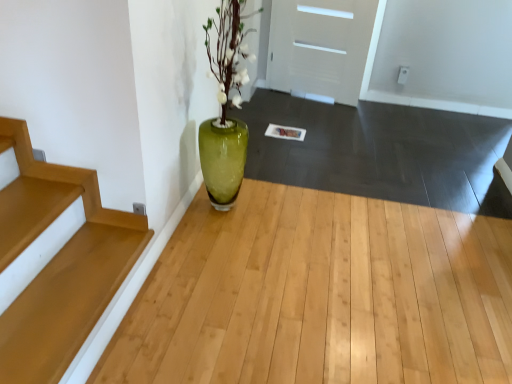
Question: From the image's perspective, is white matte door at upper center on top of green glass vase at center?

Choices:
 (A) yes
 (B) no

Answer: (A)

Question: Is white matte door at upper center taller than green glass vase at center?

Choices:
 (A) yes
 (B) no

Answer: (A)

Question: Does white matte door at upper center have a lesser width compared to green glass vase at center?

Choices:
 (A) no
 (B) yes

Answer: (B)

Question: Is white matte door at upper center bigger than green glass vase at center?

Choices:
 (A) yes
 (B) no

Answer: (B)

Question: Could you tell me if white matte door at upper center is turned towards green glass vase at center?

Choices:
 (A) yes
 (B) no

Answer: (B)

Question: In terms of width, does white matte door at upper center look wider or thinner when compared to green glass vase at center?

Choices:
 (A) wide
 (B) thin

Answer: (B)

Question: Is white matte door at upper center inside the boundaries of green glass vase at center, or outside?

Choices:
 (A) outside
 (B) inside

Answer: (A)

Question: Is white matte door at upper center bigger or smaller than green glass vase at center?

Choices:
 (A) big
 (B) small

Answer: (B)

Question: From the image's perspective, is white matte door at upper center located above or below green glass vase at center?

Choices:
 (A) above
 (B) below

Answer: (A)

Question: Considering the positions of white matte door at upper center and wooden stairs at lower left in the image, is white matte door at upper center bigger or smaller than wooden stairs at lower left?

Choices:
 (A) small
 (B) big

Answer: (B)

Question: Does point (306, 49) appear closer or farther from the camera than point (4, 139)?

Choices:
 (A) farther
 (B) closer

Answer: (A)

Question: Considering the positions of white matte door at upper center and wooden stairs at lower left in the image, is white matte door at upper center wider or thinner than wooden stairs at lower left?

Choices:
 (A) wide
 (B) thin

Answer: (B)

Question: From a real-world perspective, is white matte door at upper center above or below wooden stairs at lower left?

Choices:
 (A) above
 (B) below

Answer: (A)

Question: Is wooden stairs at lower left to the left or to the right of white matte door at upper center in the image?

Choices:
 (A) left
 (B) right

Answer: (A)

Question: From their relative heights in the image, would you say wooden stairs at lower left is taller or shorter than white matte door at upper center?

Choices:
 (A) tall
 (B) short

Answer: (B)